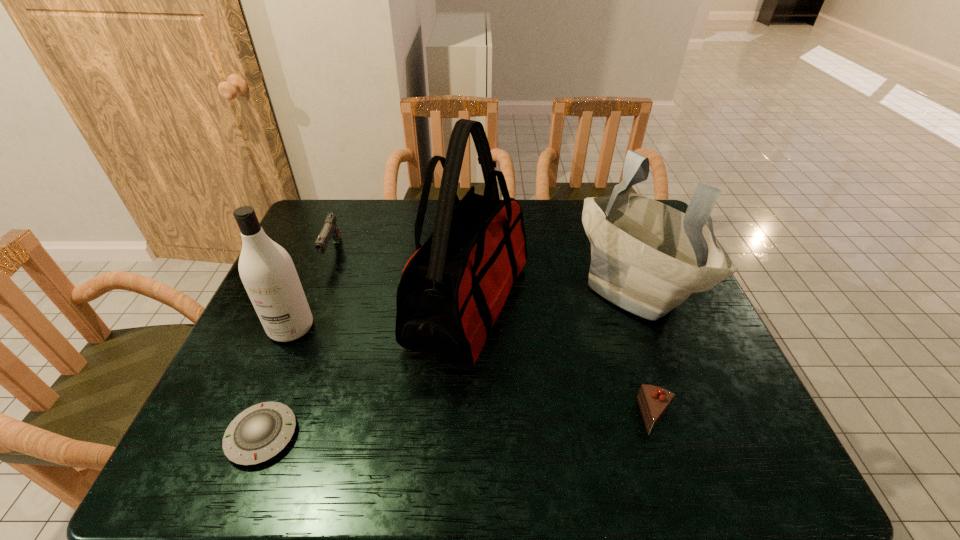
At what (x,y) coordinates should I click in order to perform the action: click on free space in the image that satisfies the following two spatial constraints: 1. on the front-facing side of the second shortest object; 2. on the right side of the shampoo. Please return your answer as a coordinate pair (x, y). The height and width of the screenshot is (540, 960). Looking at the image, I should click on (253, 416).

Where is `vacant space that satisfies the following two spatial constraints: 1. on the front-facing side of the fifth tallest object; 2. on the right side of the shampoo`? vacant space that satisfies the following two spatial constraints: 1. on the front-facing side of the fifth tallest object; 2. on the right side of the shampoo is located at coordinates (253, 416).